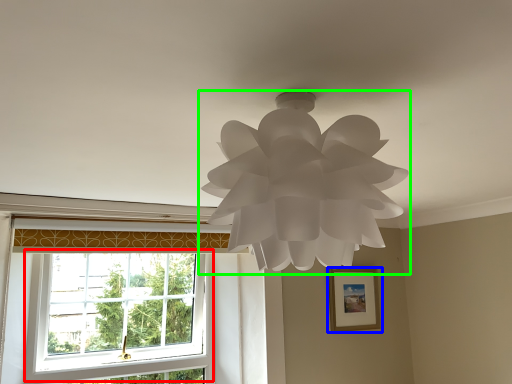
Question: Based on their relative distances, which object is farther from window (highlighted by a red box)? Choose from picture frame (highlighted by a blue box) and lamp (highlighted by a green box).

Choices:
 (A) picture frame
 (B) lamp

Answer: (B)